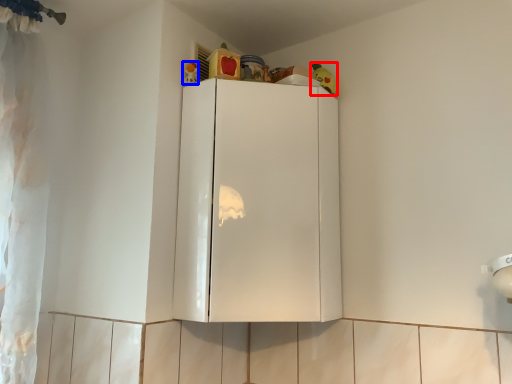
Question: Which of the following is the closest to the observer, toy (highlighted by a red box) or toy (highlighted by a blue box)?

Choices:
 (A) toy
 (B) toy

Answer: (B)